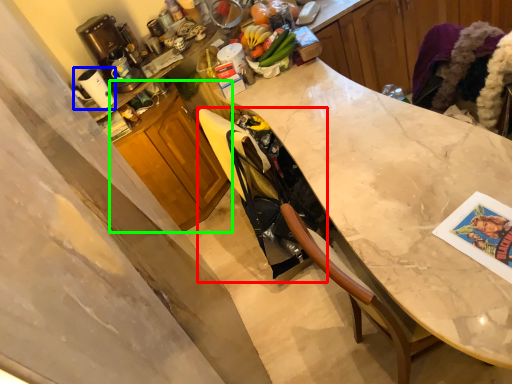
Question: Which is nearer to the swivel chair (highlighted by a red box)? appliance (highlighted by a blue box) or cabinetry (highlighted by a green box).

Choices:
 (A) appliance
 (B) cabinetry

Answer: (B)